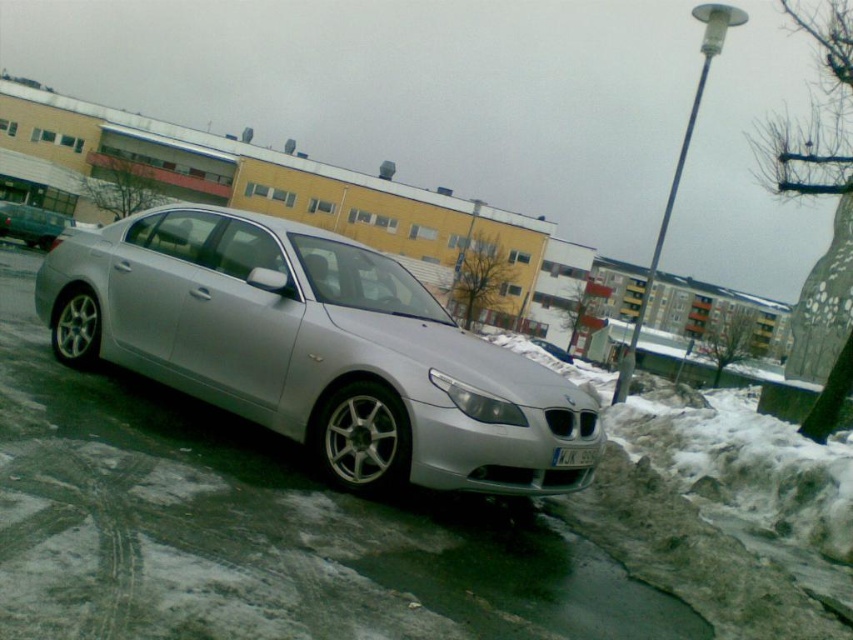
Who is more forward, (593, 403) or (572, 448)?

Point (572, 448) is more forward.

Where is `satin silver car at center`? satin silver car at center is located at coordinates (312, 349).